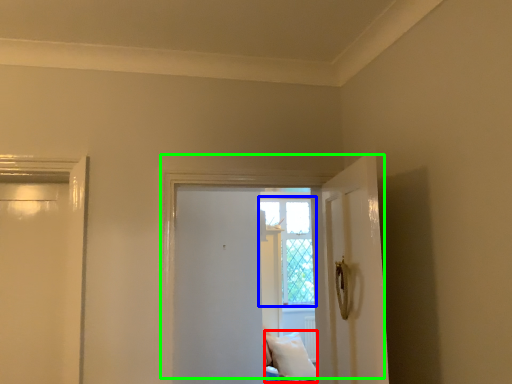
Question: Which object is positioned farthest from pillow (highlighted by a red box)? Select from window (highlighted by a blue box) and door (highlighted by a green box).

Choices:
 (A) window
 (B) door

Answer: (B)